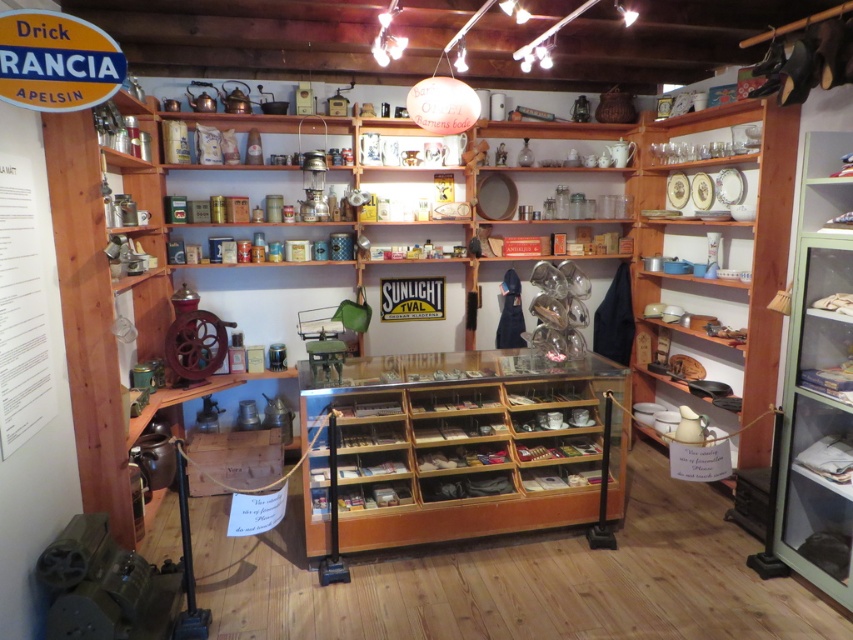
You are an interior designer planning to move the wooden display case at center and the green glass cabinet at right to a new exhibition space. Which object should you move first if you want to place the larger item closer to the entrance for maximum visibility?

The wooden display case at center is bigger than the green glass cabinet at right, so you should move the wooden display case at center first to place it closer to the entrance for maximum visibility.

You are standing in the vintage shop and want to reach both the point at coordinates [395,445] and the point at coordinates [782,426]. Which point is closer to you?

The point at coordinates [395,445] is closer to you because it is further to the viewer than the point at coordinates [782,426].

You are a customer in the vintage shop and want to examine both the wooden display case at center and the green glass cabinet at right. Which one should you approach first if you are standing at the entrance facing the center of the room?

You should approach the wooden display case at center first because it is located to the left of the green glass cabinet at right, making it closer to your left side when facing the center of the room.